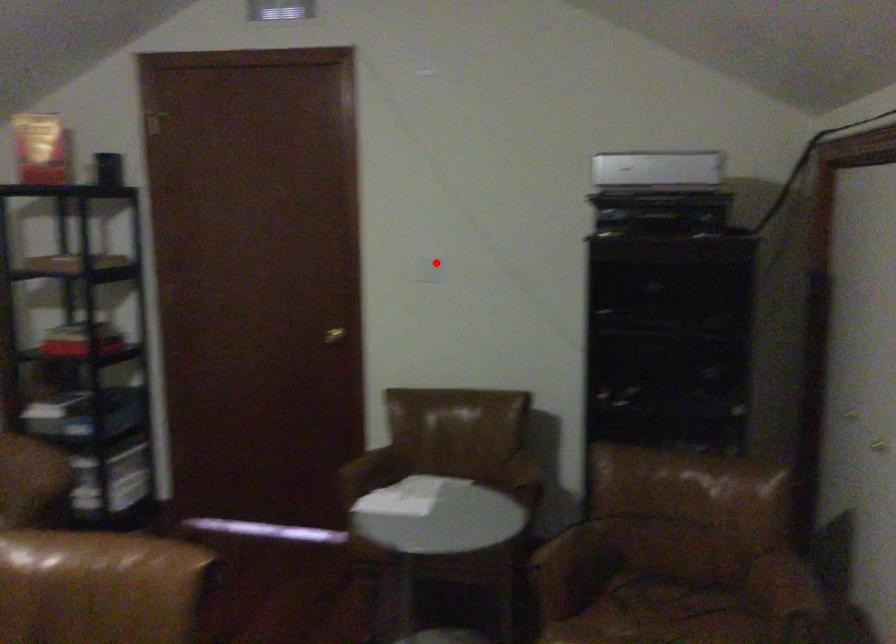
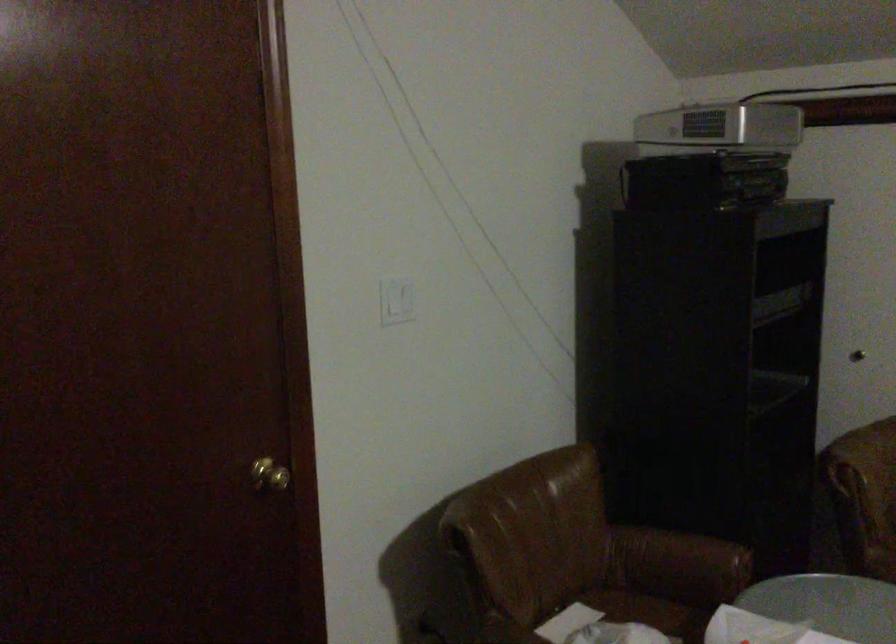
Where in the second image is the point corresponding to the highlighted location from the first image?

(397, 301)